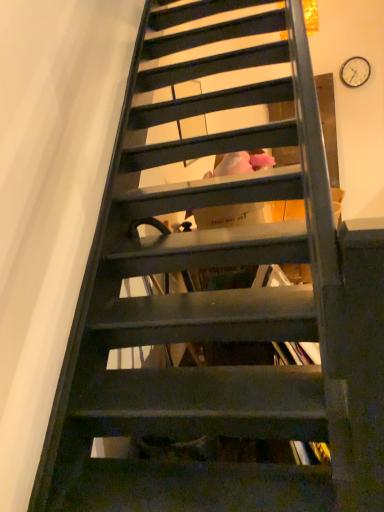
You are a GUI agent. You are given a task and a screenshot of the screen. Output one action in this format:
    pyautogui.click(x=<x>, y=<y>)
    Task: Click on the metallic silver clock at upper right
    The width and height of the screenshot is (384, 512).
    Given the screenshot: What is the action you would take?
    pyautogui.click(x=355, y=72)

What do you see at coordinates (355, 72) in the screenshot? I see `metallic silver clock at upper right` at bounding box center [355, 72].

Where is `metallic silver clock at upper right`? The image size is (384, 512). metallic silver clock at upper right is located at coordinates (355, 72).